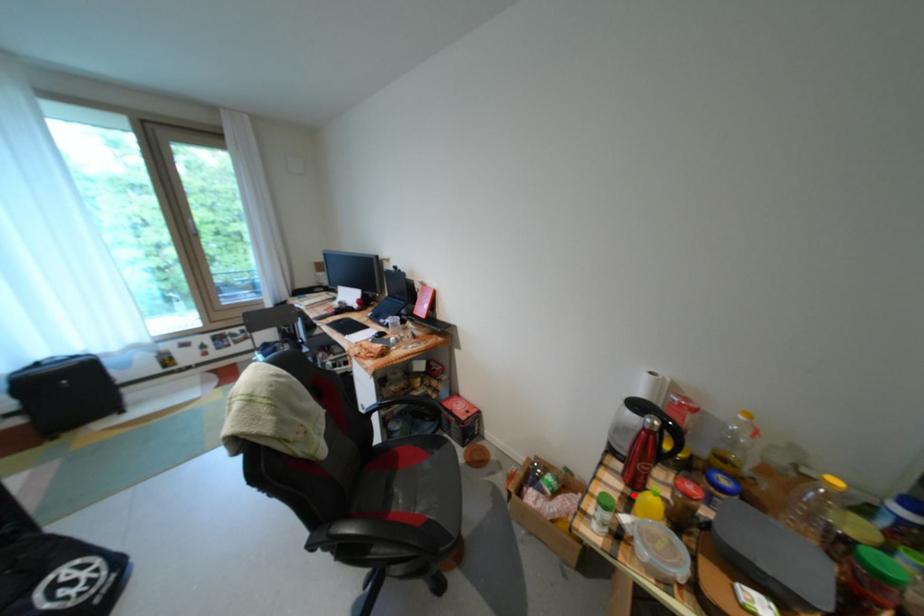
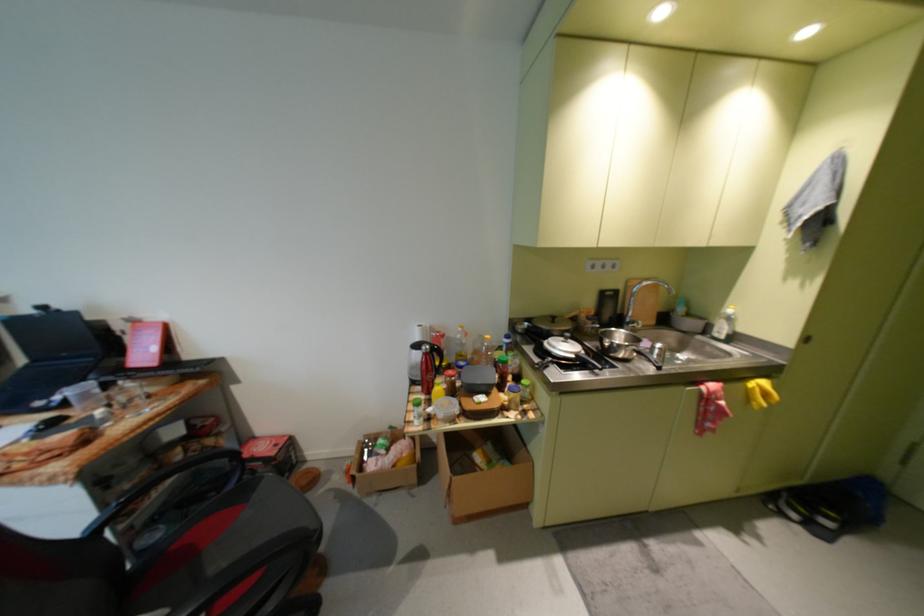
Locate, in the second image, the point that corresponds to the highlighted location in the first image.

(435, 400)